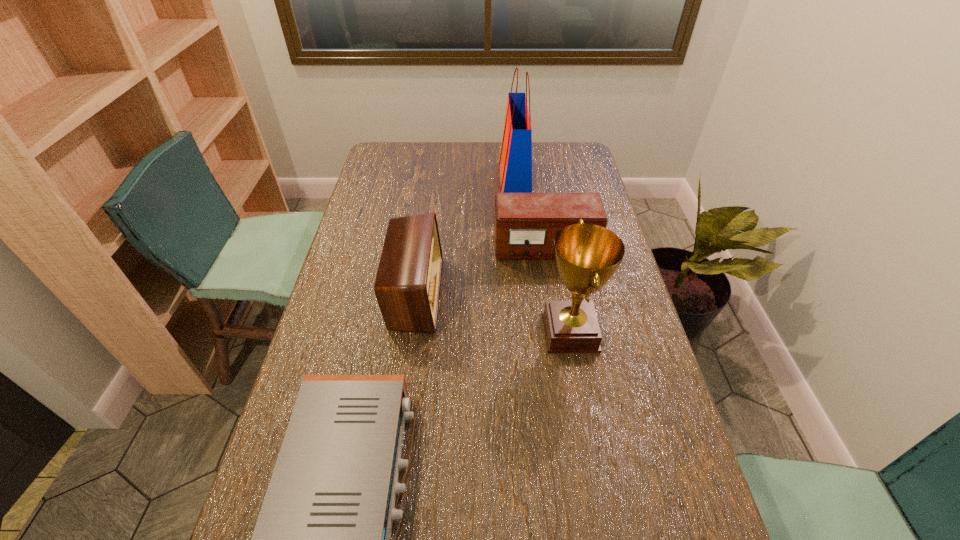
I want to click on vacant space located on the front-facing side of the rightmost radio receiver, so click(557, 324).

What are the coordinates of `object located in the far edge section of the desktop` in the screenshot? It's located at (515, 162).

Find the location of a particular element. This screenshot has height=540, width=960. award that is at the right edge is located at coordinates (587, 255).

Locate an element on the screen. radio receiver that is at the right edge is located at coordinates (525, 224).

The height and width of the screenshot is (540, 960). In order to click on vacant area at the far edge in this screenshot , I will do `click(450, 144)`.

This screenshot has height=540, width=960. Identify the location of free space at the left edge of the desktop. (381, 173).

Where is `vacant space at the right edge of the desktop`? This screenshot has width=960, height=540. vacant space at the right edge of the desktop is located at coordinates coord(565,179).

Where is `vacant space at the far left corner of the desktop`? This screenshot has width=960, height=540. vacant space at the far left corner of the desktop is located at coordinates (395, 163).

The height and width of the screenshot is (540, 960). In the image, there is a desktop. Identify the location of free space at the far right corner. (580, 156).

Where is `blank region between the second tallest object and the rightmost radio receiver`? blank region between the second tallest object and the rightmost radio receiver is located at coordinates (558, 291).